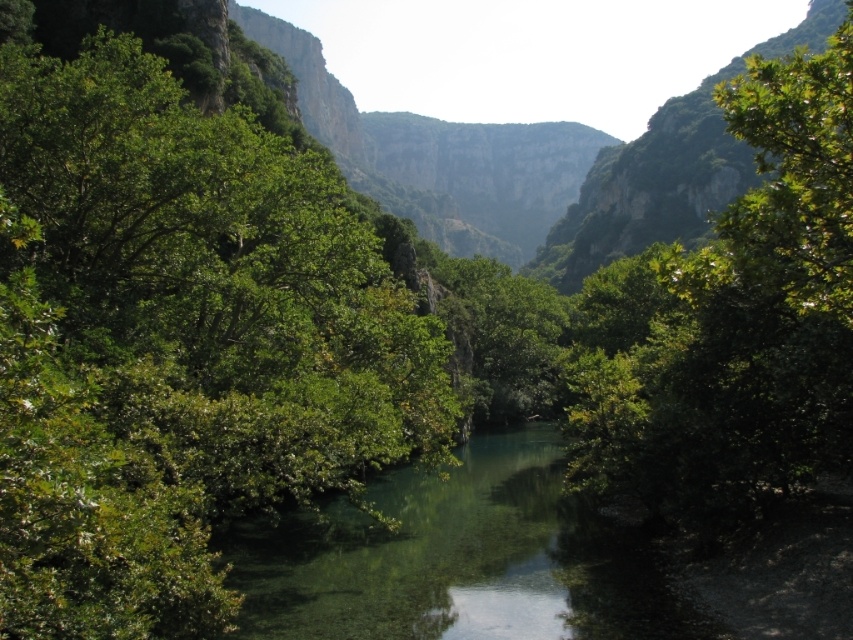
This screenshot has width=853, height=640. What do you see at coordinates (177, 342) in the screenshot?
I see `green leafy tree at left` at bounding box center [177, 342].

Is point (120, 506) positioned after point (387, 602)?

No, it is in front of (387, 602).

Locate an element on the screen. The width and height of the screenshot is (853, 640). green leafy tree at left is located at coordinates [x=177, y=342].